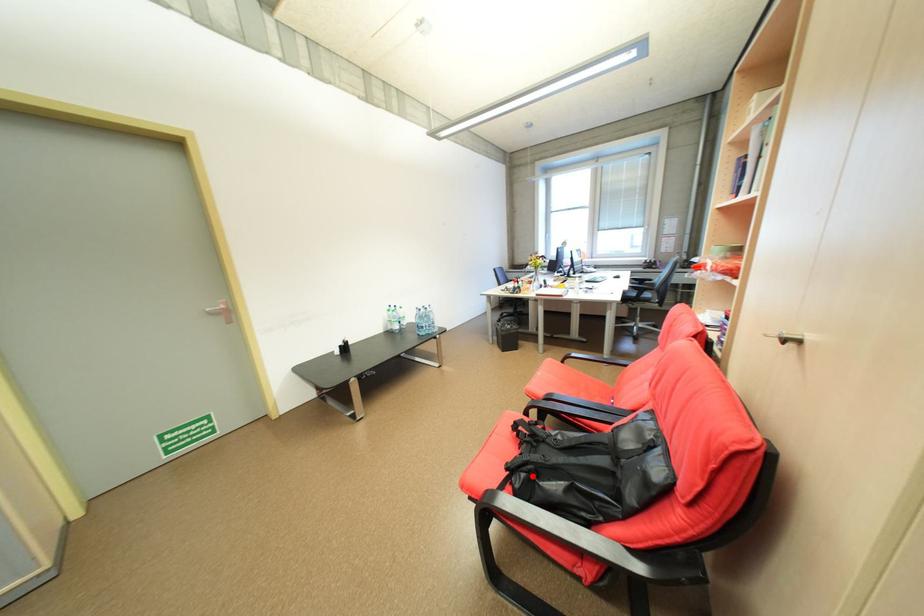
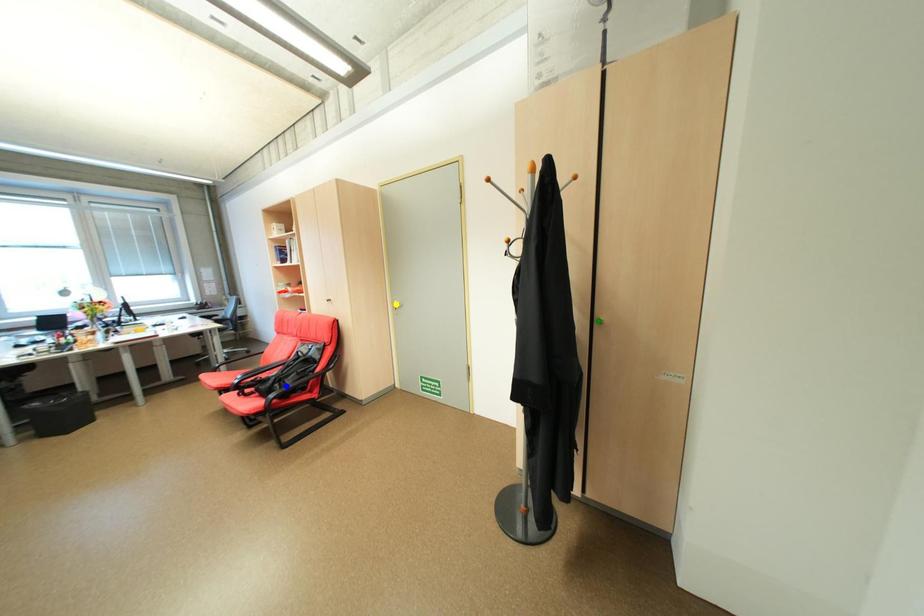
Question: I am providing you with two images of the same scene from different viewpoints. A red point is marked on the first image. You are given multiple points on the second image. Which spot in image 2 lines up with the point in image 1?

Choices:
 (A) green point
 (B) blue point
 (C) yellow point

Answer: (B)